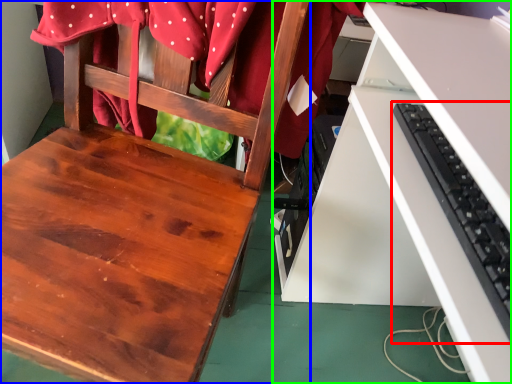
Question: Based on their relative distances, which object is farther from computer keyboard (highlighted by a red box)? Choose from chair (highlighted by a blue box) and desk (highlighted by a green box).

Choices:
 (A) chair
 (B) desk

Answer: (A)